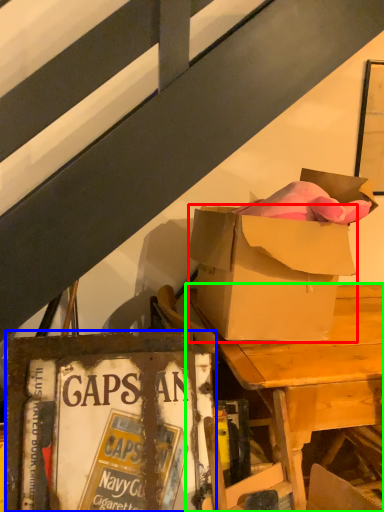
Question: Based on their relative distances, which object is farther from box (highlighted by a red box)? Choose from paperback book (highlighted by a blue box) and desk (highlighted by a green box).

Choices:
 (A) paperback book
 (B) desk

Answer: (A)